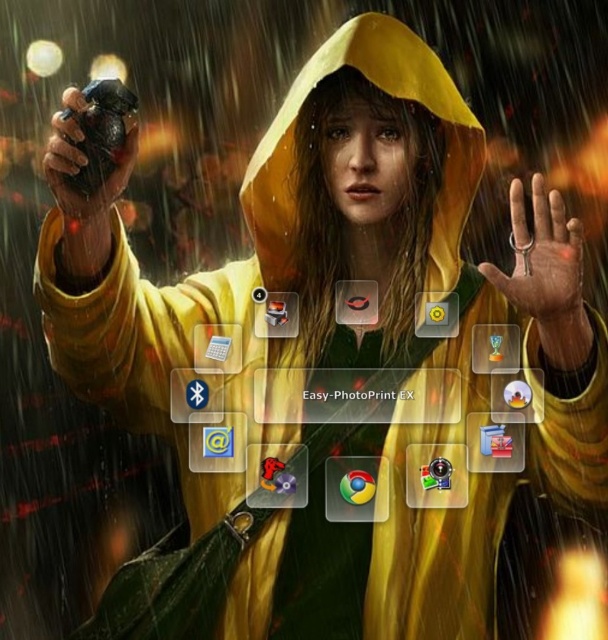
Question: Does yellow matte hood at center lie in front of smooth metallic key at center?

Choices:
 (A) no
 (B) yes

Answer: (A)

Question: Estimate the real-world distances between objects in this image. Which object is farther from the smooth metallic key at center?

Choices:
 (A) rubberized black grip at left
 (B) yellow matte hood at center

Answer: (A)

Question: Is yellow matte hood at center to the right of rubberized black grip at left from the viewer's perspective?

Choices:
 (A) yes
 (B) no

Answer: (A)

Question: Can you confirm if yellow matte hood at center is positioned to the right of smooth metallic key at center?

Choices:
 (A) no
 (B) yes

Answer: (A)

Question: Which point is farther to the camera?

Choices:
 (A) (283, 182)
 (B) (527, 250)

Answer: (A)

Question: Based on their relative distances, which object is farther from the rubberized black grip at left?

Choices:
 (A) smooth metallic key at center
 (B) yellow matte hood at center

Answer: (A)